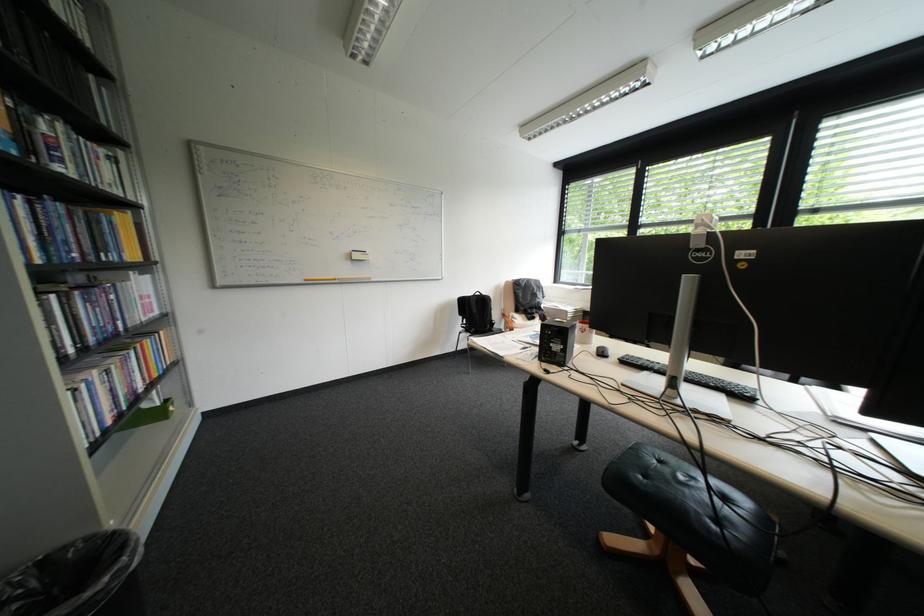
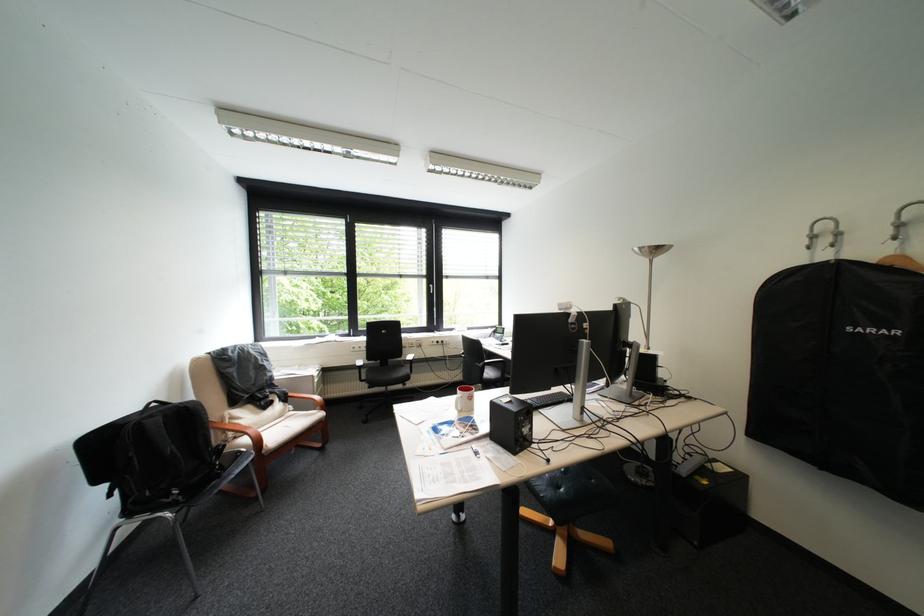
Where in the second image is the point corresponding to (x=496, y=297) from the first image?

(199, 407)